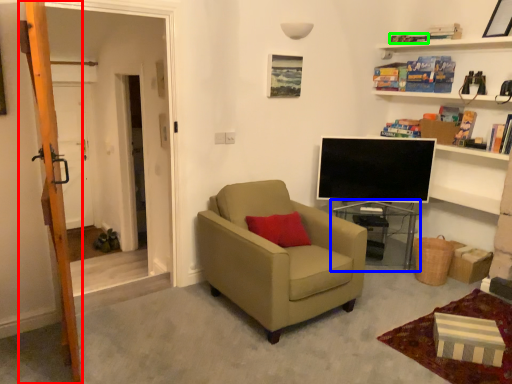
Question: Based on their relative distances, which object is farther from ladder (highlighted by a red box)? Choose from table (highlighted by a blue box) and book (highlighted by a green box).

Choices:
 (A) table
 (B) book

Answer: (B)